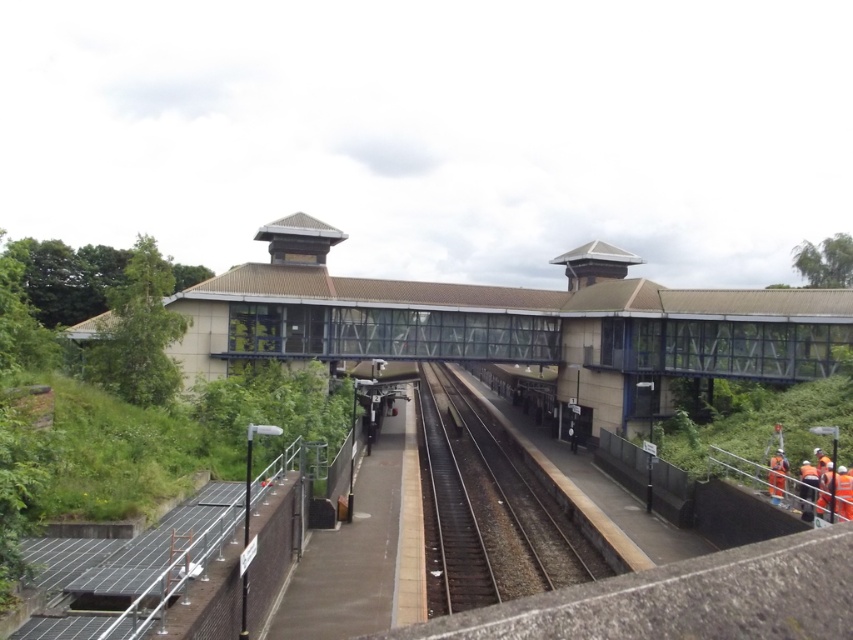
Consider the image. Which is more to the right, smooth steel tracks at center or orange reflective safety vest at right?

orange reflective safety vest at right is more to the right.

Identify the location of smooth steel tracks at center. The image size is (853, 640). (489, 509).

Who is higher up, smooth steel tracks at center or orange reflective rail at lower right?

orange reflective rail at lower right is above.

Which is behind, point (422, 387) or point (837, 481)?

Positioned behind is point (422, 387).

Is point (550, 577) closer to camera compared to point (787, 500)?

No, it is behind (787, 500).

Identify the location of smooth steel tracks at center. Image resolution: width=853 pixels, height=640 pixels. (489, 509).

Is smooth steel tracks at center to the left of orange reflective vest at lower right from the viewer's perspective?

Yes, smooth steel tracks at center is to the left of orange reflective vest at lower right.

Can you confirm if smooth steel tracks at center is shorter than orange reflective vest at lower right?

No.

The width and height of the screenshot is (853, 640). What do you see at coordinates (489, 509) in the screenshot? I see `smooth steel tracks at center` at bounding box center [489, 509].

The height and width of the screenshot is (640, 853). I want to click on smooth steel tracks at center, so click(x=489, y=509).